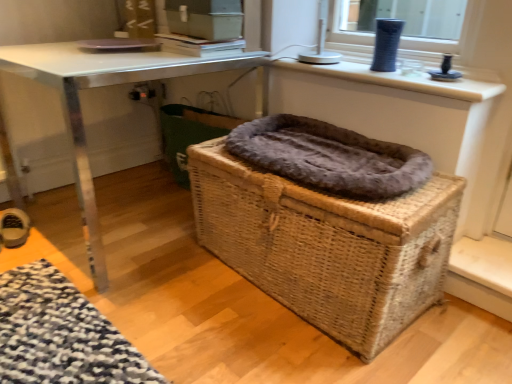
Question: From the image's perspective, would you say fuzzy brown laundry basket at center is shown under matte blue vase at upper right?

Choices:
 (A) no
 (B) yes

Answer: (B)

Question: Can you confirm if fuzzy brown laundry basket at center is shorter than matte blue vase at upper right?

Choices:
 (A) yes
 (B) no

Answer: (B)

Question: Can you confirm if fuzzy brown laundry basket at center is taller than matte blue vase at upper right?

Choices:
 (A) no
 (B) yes

Answer: (B)

Question: From a real-world perspective, is fuzzy brown laundry basket at center physically above matte blue vase at upper right?

Choices:
 (A) yes
 (B) no

Answer: (B)

Question: Considering the relative sizes of fuzzy brown laundry basket at center and matte blue vase at upper right in the image provided, is fuzzy brown laundry basket at center smaller than matte blue vase at upper right?

Choices:
 (A) no
 (B) yes

Answer: (A)

Question: In terms of height, does woven brown basket at center look taller or shorter compared to fuzzy brown laundry basket at center?

Choices:
 (A) short
 (B) tall

Answer: (A)

Question: Is woven brown basket at center wider or thinner than fuzzy brown laundry basket at center?

Choices:
 (A) wide
 (B) thin

Answer: (A)

Question: In terms of size, does woven brown basket at center appear bigger or smaller than fuzzy brown laundry basket at center?

Choices:
 (A) small
 (B) big

Answer: (B)

Question: From the image's perspective, is woven brown basket at center positioned above or below fuzzy brown laundry basket at center?

Choices:
 (A) above
 (B) below

Answer: (B)

Question: From the image's perspective, is metallic silver table at center above or below woven brown basket at center?

Choices:
 (A) below
 (B) above

Answer: (B)

Question: Is point (70, 82) closer or farther from the camera than point (367, 210)?

Choices:
 (A) closer
 (B) farther

Answer: (B)

Question: From a real-world perspective, is metallic silver table at center positioned above or below woven brown basket at center?

Choices:
 (A) below
 (B) above

Answer: (B)

Question: Would you say metallic silver table at center is inside or outside woven brown basket at center?

Choices:
 (A) outside
 (B) inside

Answer: (A)

Question: Looking at their shapes, would you say fuzzy brown laundry basket at center is wider or thinner than fuzzy gray blanket at center?

Choices:
 (A) thin
 (B) wide

Answer: (A)

Question: Visually, is fuzzy brown laundry basket at center positioned to the left or to the right of fuzzy gray blanket at center?

Choices:
 (A) right
 (B) left

Answer: (B)